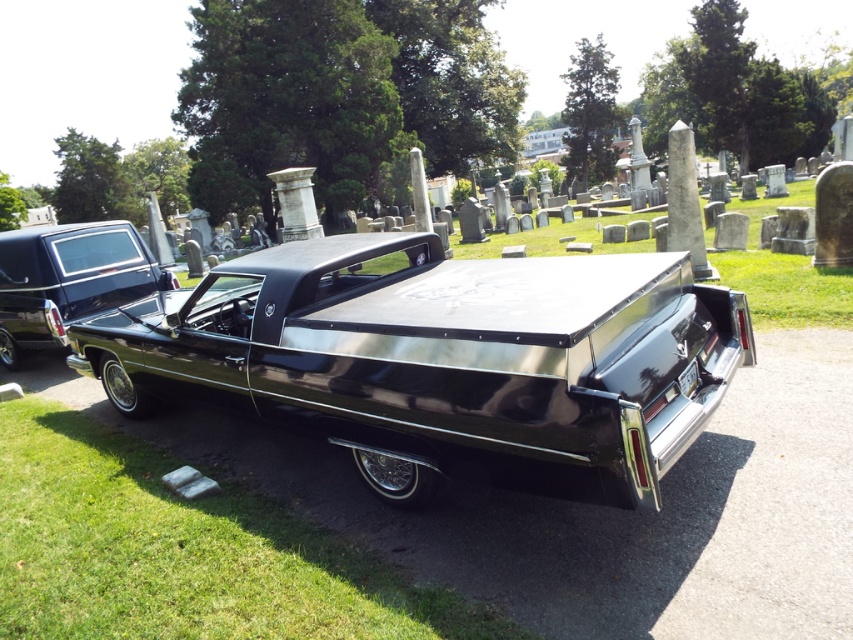
Question: Which point is farther from the camera taking this photo?

Choices:
 (A) (416, 387)
 (B) (386, 593)
 (C) (115, 243)

Answer: (C)

Question: Can you confirm if glossy black car at center is positioned below glossy black car at left?

Choices:
 (A) yes
 (B) no

Answer: (A)

Question: Which of the following is the farthest from the observer?

Choices:
 (A) (625, 483)
 (B) (375, 588)
 (C) (39, 260)

Answer: (C)

Question: Does glossy black car at center have a larger size compared to green grass at lower left?

Choices:
 (A) yes
 (B) no

Answer: (A)

Question: Is green grass at lower left to the left of glossy black car at left from the viewer's perspective?

Choices:
 (A) yes
 (B) no

Answer: (B)

Question: Which object appears closest to the camera in this image?

Choices:
 (A) glossy black car at center
 (B) green grass at lower left

Answer: (A)